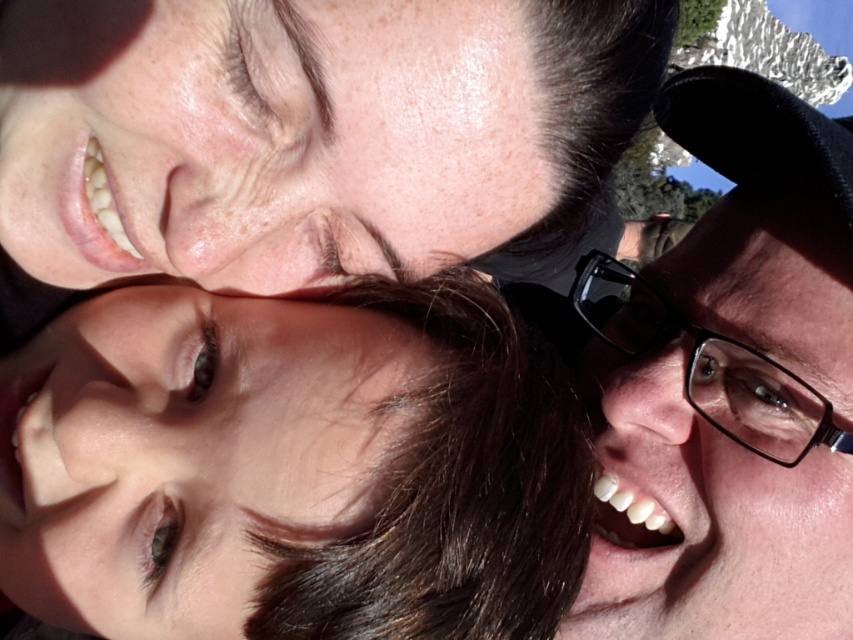
Who is more distant from viewer, (276, 396) or (772, 380)?

The point (772, 380) is behind.

Is smooth brown hair at center above black plastic glasses at upper right?

No.

Which is behind, point (355, 448) or point (785, 436)?

The point (785, 436) is more distant.

You are a GUI agent. You are given a task and a screenshot of the screen. Output one action in this format:
    pyautogui.click(x=<x>, y=<y>)
    Task: Click on the smooth brown hair at center
    The image size is (853, 640).
    Given the screenshot: What is the action you would take?
    pyautogui.click(x=292, y=467)

Is black plastic glasses at right closer to camera compared to black plastic glasses at upper right?

Yes, black plastic glasses at right is closer to the viewer.

This screenshot has height=640, width=853. What do you see at coordinates (732, 388) in the screenshot?
I see `black plastic glasses at right` at bounding box center [732, 388].

Find the location of a particular element. The height and width of the screenshot is (640, 853). black plastic glasses at right is located at coordinates (732, 388).

Consider the image. Does smooth brown hair at center have a smaller size compared to black plastic glasses at right?

Yes, smooth brown hair at center is smaller than black plastic glasses at right.

What do you see at coordinates (292, 467) in the screenshot? I see `smooth brown hair at center` at bounding box center [292, 467].

Identify the location of smooth brown hair at center. (292, 467).